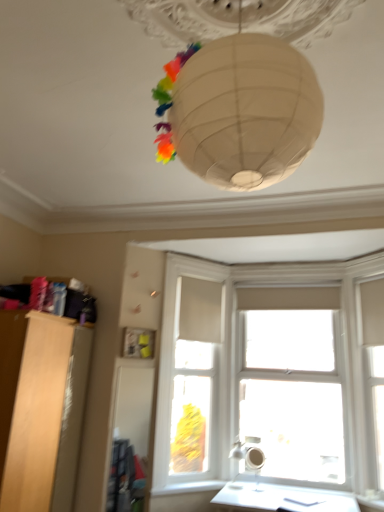
I want to click on empty space that is ontop of white smooth window sill at lower center (from a real-world perspective), so click(x=179, y=485).